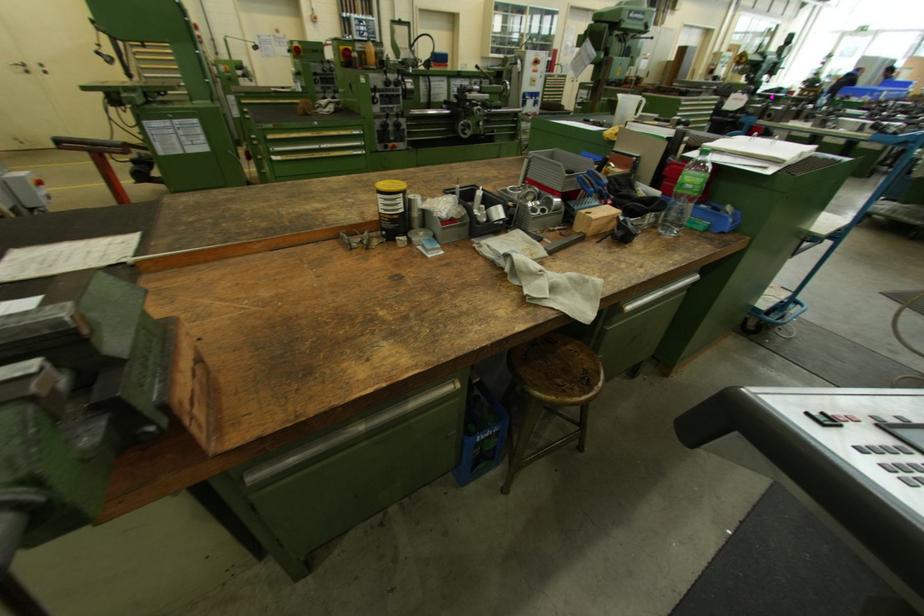
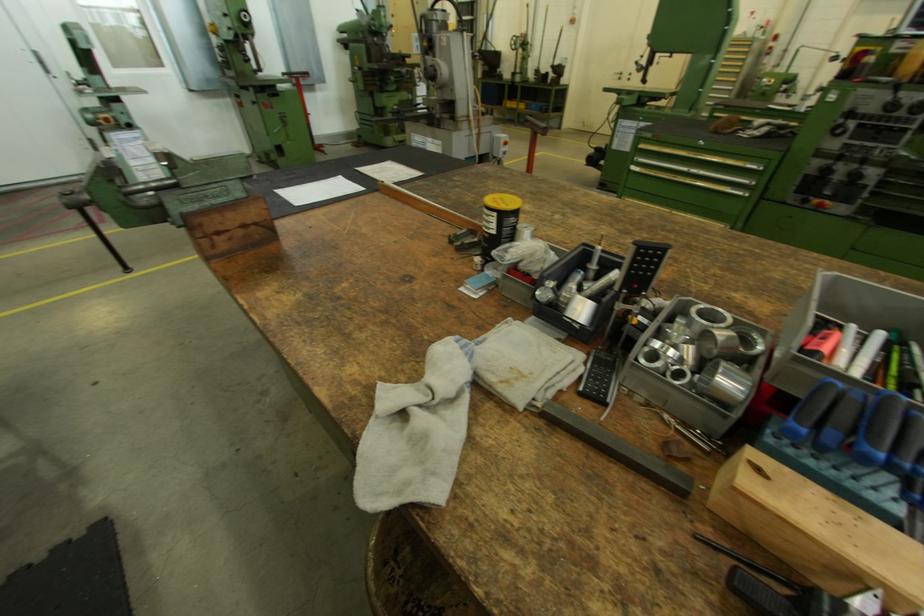
Question: I am providing you with two images of the same scene from different viewpoints. After the viewpoint changes to image2, which objects are now occluded?

Choices:
 (A) silver drawer handle
 (B) yellow container lid
 (C) black remote control
 (D) none of these

Answer: (D)